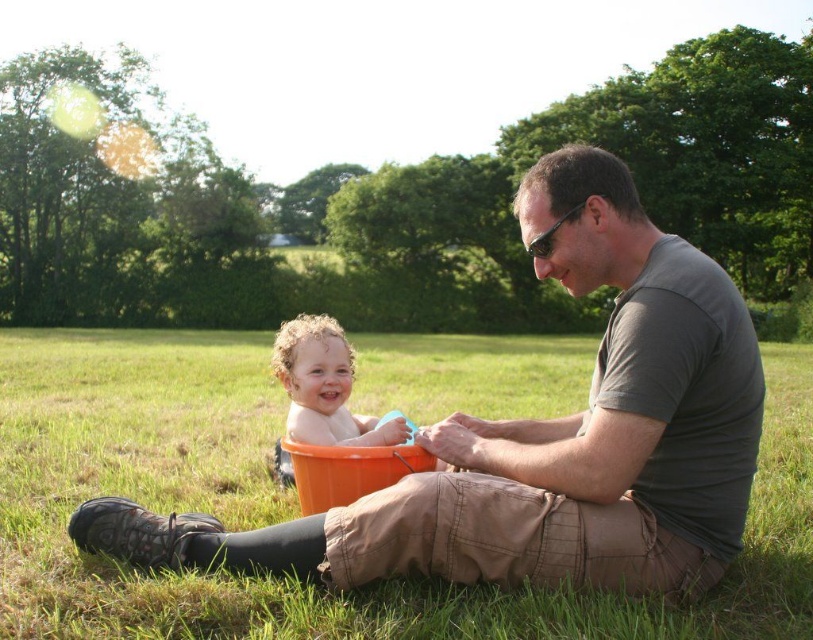
Question: Considering the relative positions of green grass at center and curly blonde hair at center in the image provided, where is green grass at center located with respect to curly blonde hair at center?

Choices:
 (A) above
 (B) below

Answer: (A)

Question: From the image, what is the correct spatial relationship of green grass at center in relation to curly blonde hair at center?

Choices:
 (A) left
 (B) right

Answer: (B)

Question: Which point appears closest to the camera in this image?

Choices:
 (A) (192, 385)
 (B) (288, 420)

Answer: (B)

Question: Which point appears closest to the camera in this image?

Choices:
 (A) (7, 355)
 (B) (314, 442)

Answer: (B)

Question: Which point is closer to the camera?

Choices:
 (A) curly blonde hair at center
 (B) green grass at center

Answer: (B)

Question: Can you confirm if green grass at center is wider than curly blonde hair at center?

Choices:
 (A) yes
 (B) no

Answer: (A)